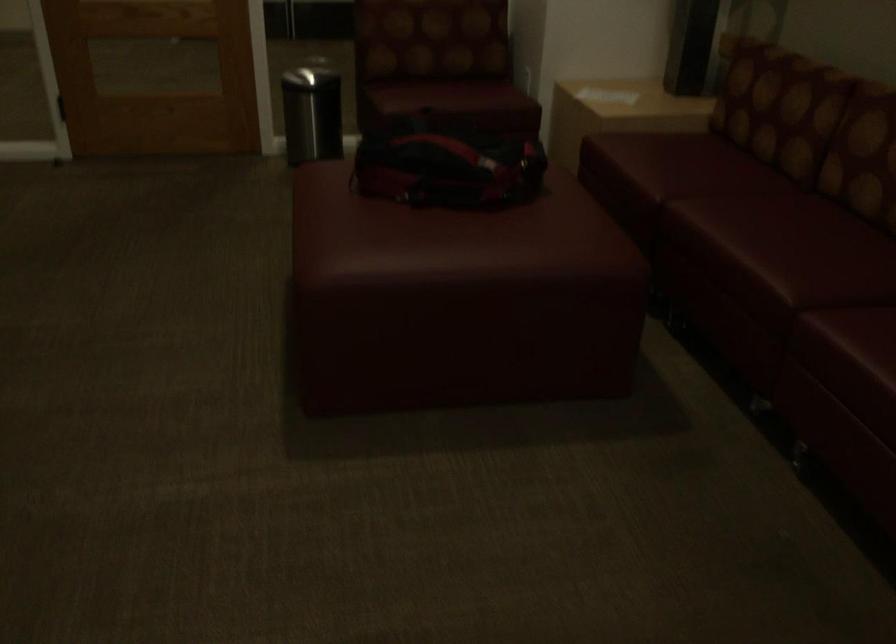
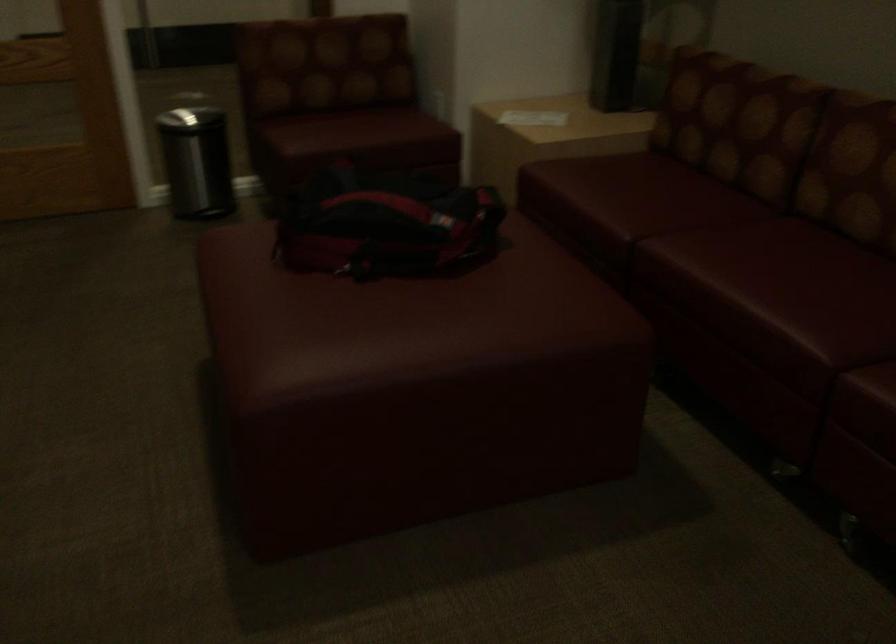
Based on the photo, in a continuous first-person perspective shot, in which direction is the camera moving?

The movement direction of the cameraman is left, forward.